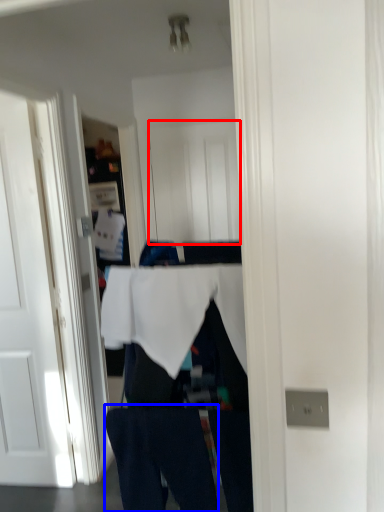
Question: Which object is closer to the camera taking this photo, door (highlighted by a red box) or jeans (highlighted by a blue box)?

Choices:
 (A) door
 (B) jeans

Answer: (B)